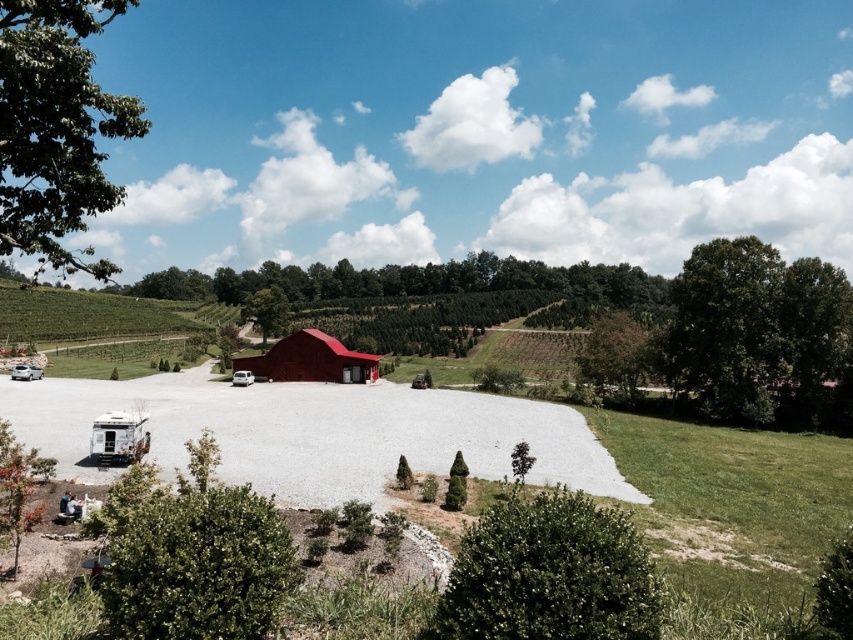
Which is more to the left, green leafy tree at center-right or white matte recreational vehicle at center?

From the viewer's perspective, white matte recreational vehicle at center appears more on the left side.

Does green leafy tree at center-right have a greater width compared to white matte recreational vehicle at center?

Yes, green leafy tree at center-right is wider than white matte recreational vehicle at center.

This screenshot has height=640, width=853. In order to click on green leafy tree at center-right in this screenshot , I will do pyautogui.click(x=618, y=353).

Which of these two, matte red barn at center or green leafy tree at center-right, stands taller?

green leafy tree at center-right

Is the position of matte red barn at center more distant than that of green leafy tree at center-right?

Yes.

This screenshot has height=640, width=853. I want to click on matte red barn at center, so click(310, 360).

At what (x,y) coordinates should I click in order to perform the action: click on matte red barn at center. Please return your answer as a coordinate pair (x, y). The width and height of the screenshot is (853, 640). Looking at the image, I should click on (310, 360).

Image resolution: width=853 pixels, height=640 pixels. In order to click on green leafy tree at right in this screenshot , I will do `click(757, 330)`.

Where is `green leafy tree at right`? green leafy tree at right is located at coordinates (757, 330).